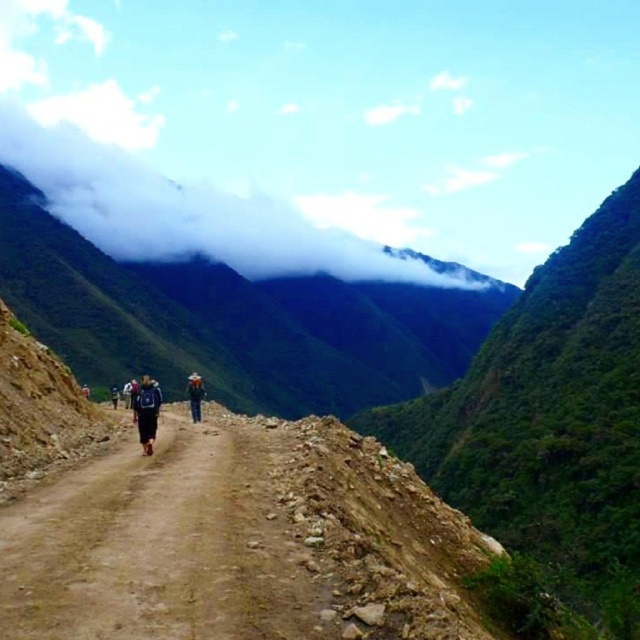
Question: Which point is closer to the camera taking this photo?

Choices:
 (A) (196, 228)
 (B) (160, 397)
 (C) (115, 388)
 (D) (202, 394)

Answer: (B)

Question: Which of the following is the farthest from the observer?

Choices:
 (A) black backpack at center
 (B) brown dirt track at center

Answer: (A)

Question: From the image, what is the correct spatial relationship of brown dirt track at center in relation to dark blue backpack at center?

Choices:
 (A) left
 (B) right

Answer: (B)

Question: Can you confirm if dark blue backpack at center is positioned above black backpack at center?

Choices:
 (A) no
 (B) yes

Answer: (B)

Question: Does brown dirt track at center appear under white fluffy cloud at upper center?

Choices:
 (A) no
 (B) yes

Answer: (B)

Question: Which is farther from the brown fabric hat at center?

Choices:
 (A) brown dirt track at center
 (B) white fluffy cloud at upper center
 (C) black backpack at center

Answer: (B)